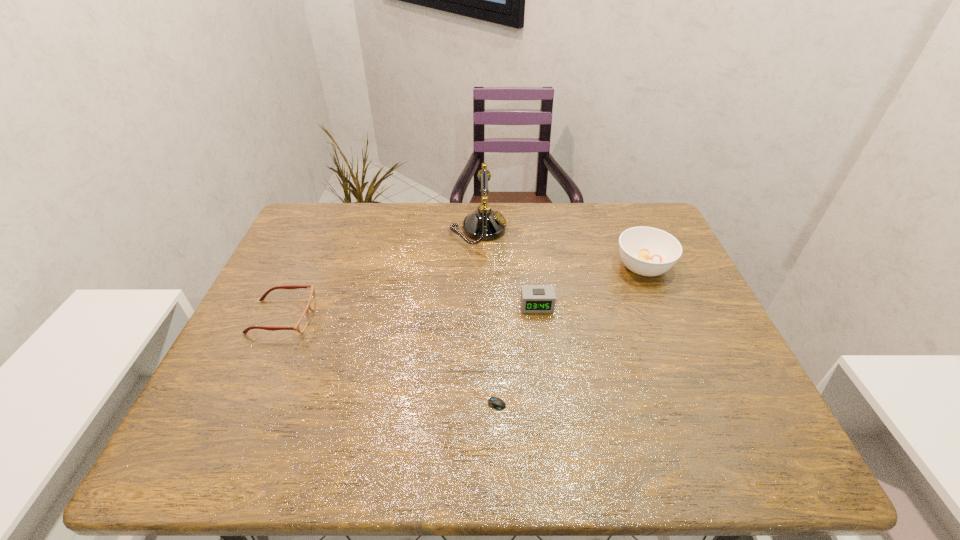
Where is `vacant point located 0.390m on the front-facing side of the leftmost object`? Image resolution: width=960 pixels, height=540 pixels. vacant point located 0.390m on the front-facing side of the leftmost object is located at coordinates (468, 317).

You are a GUI agent. You are given a task and a screenshot of the screen. Output one action in this format:
    pyautogui.click(x=<x>, y=<y>)
    Task: Click on the vacant point located on the back of the shortest object
    The image size is (960, 540).
    Given the screenshot: What is the action you would take?
    pyautogui.click(x=486, y=292)

At what (x,y) coordinates should I click in order to perform the action: click on object at the far edge. Please return your answer as a coordinate pair (x, y). Image resolution: width=960 pixels, height=540 pixels. Looking at the image, I should click on [484, 224].

I want to click on object that is positioned at the left edge, so click(x=301, y=325).

Identify the location of object at the right edge. (647, 251).

In the image, there is a desktop. Where is `vacant space at the far edge`? Image resolution: width=960 pixels, height=540 pixels. vacant space at the far edge is located at coordinates (425, 225).

What are the coordinates of `vacant space at the near edge of the desktop` in the screenshot? It's located at (523, 466).

Locate an element on the screen. The height and width of the screenshot is (540, 960). free space at the left edge of the desktop is located at coordinates (230, 376).

Identify the location of vacant area at the right edge of the desktop. The width and height of the screenshot is (960, 540). 665,289.

Locate an element on the screen. Image resolution: width=960 pixels, height=540 pixels. vacant space at the far left corner of the desktop is located at coordinates (332, 202).